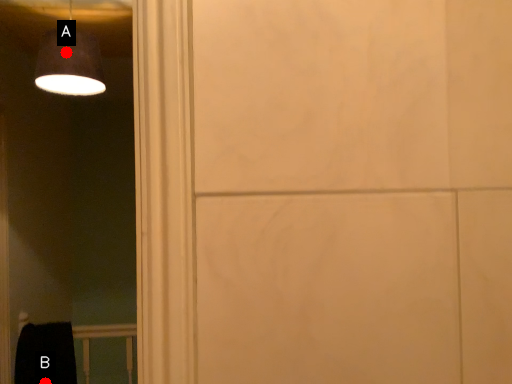
Question: Two points are circled on the image, labeled by A and B beside each circle. Which point is closer to the camera?

Choices:
 (A) A is closer
 (B) B is closer

Answer: (A)